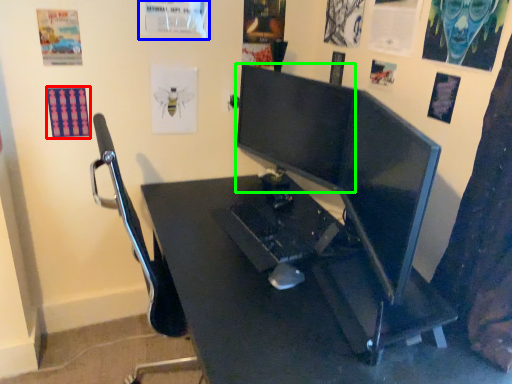
Question: Considering the real-world distances, which object is farthest from poster page (highlighted by a red box)? poster page (highlighted by a blue box) or computer monitor (highlighted by a green box)?

Choices:
 (A) poster page
 (B) computer monitor

Answer: (B)